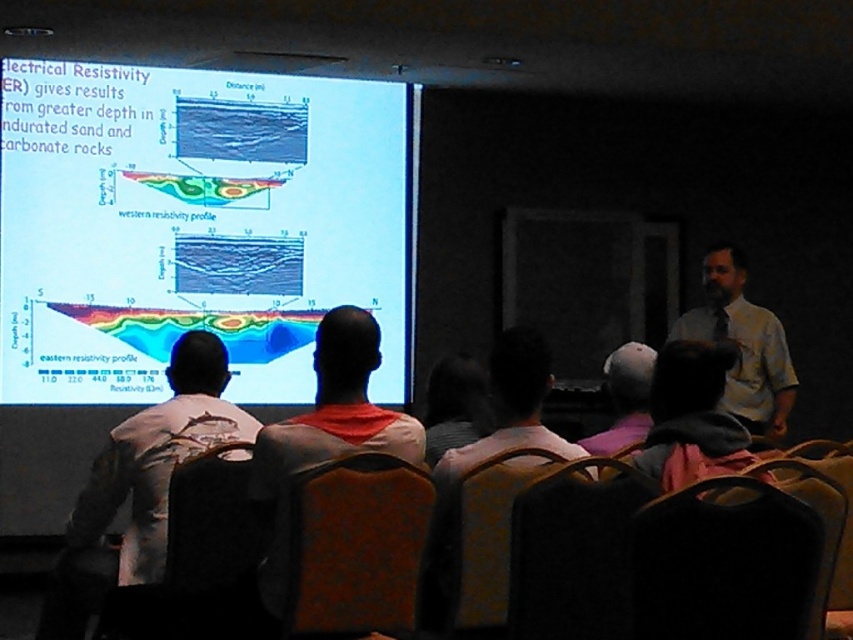
Question: Is brown fabric chair at center to the right of velvet brown chair at lower left from the viewer's perspective?

Choices:
 (A) yes
 (B) no

Answer: (A)

Question: Does orange fabric shirt at center appear over yellow shirt at right?

Choices:
 (A) yes
 (B) no

Answer: (B)

Question: Estimate the real-world distances between objects in this image. Which object is farther from the yellow shirt at right?

Choices:
 (A) orange fabric shirt at center
 (B) pink fabric at upper center

Answer: (A)

Question: Among these objects, which one is farthest from the camera?

Choices:
 (A) pink fabric at upper center
 (B) velvet black chair at lower center
 (C) brown fabric chair at center

Answer: (C)

Question: Among these points, which one is farthest from the camera?

Choices:
 (A) (260, 621)
 (B) (704, 481)

Answer: (A)

Question: Does white glossy projection screen at upper center have a larger size compared to pink fabric at upper center?

Choices:
 (A) yes
 (B) no

Answer: (A)